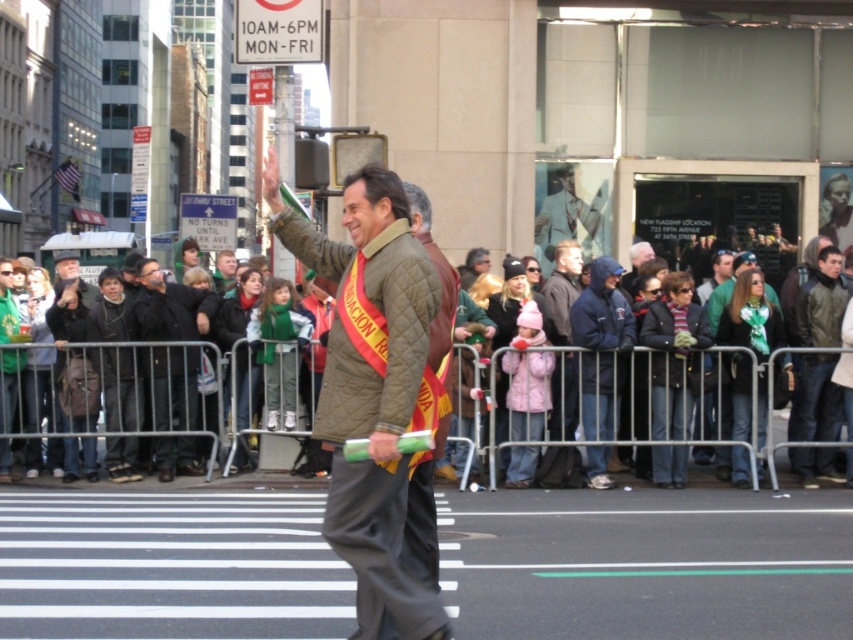
Is quilted brown jacket at center below green wool scarf at center?

Yes, quilted brown jacket at center is below green wool scarf at center.

Between quilted brown jacket at center and green wool scarf at center, which one appears on the left side from the viewer's perspective?

green wool scarf at center is more to the left.

Which is behind, point (339, 298) or point (223, 259)?

The point (223, 259) is more distant.

I want to click on quilted brown jacket at center, so click(373, 396).

Can you confirm if leather jacket at center is shorter than green wool scarf at center?

No.

Is leather jacket at center thinner than green wool scarf at center?

Indeed, leather jacket at center has a lesser width compared to green wool scarf at center.

Identify the location of leather jacket at center. 821,301.

Who is shorter, black quilted jacket at center or dark gray jacket at left?

black quilted jacket at center

Which is in front, point (170, 336) or point (45, 316)?

Point (45, 316) is more forward.

Is point (173, 362) farther from camera compared to point (67, 467)?

Yes, point (173, 362) is farther from viewer.

Identify the location of black quilted jacket at center. The width and height of the screenshot is (853, 640). (169, 307).